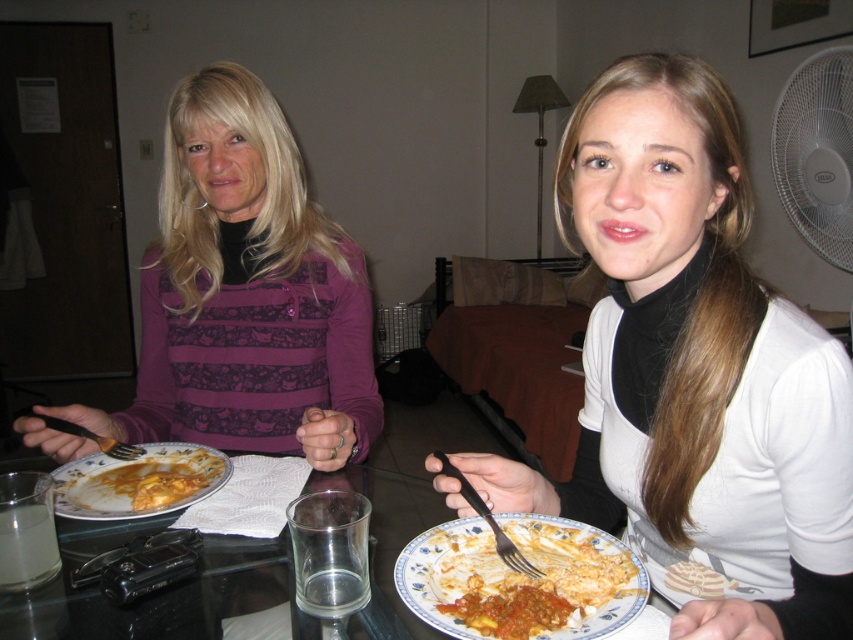
Question: Does purple lace sweater at upper left have a smaller size compared to glassy plastic table at center?

Choices:
 (A) no
 (B) yes

Answer: (A)

Question: Does glassy plastic table at center appear over white plastic fan at upper right?

Choices:
 (A) no
 (B) yes

Answer: (A)

Question: Does white matte shirt at center have a greater width compared to black plastic fork at lower center?

Choices:
 (A) no
 (B) yes

Answer: (B)

Question: Estimate the real-world distances between objects in this image. Which object is farther from the black plastic fork at left?

Choices:
 (A) porcelain floral plate at lower center
 (B) tomato sauce pasta at lower center
 (C) purple lace sweater at upper left
 (D) white plastic fan at upper right

Answer: (D)

Question: Estimate the real-world distances between objects in this image. Which object is farther from the purple lace sweater at upper left?

Choices:
 (A) porcelain floral plate at lower center
 (B) black plastic fork at left
 (C) white matte shirt at center
 (D) black plastic fork at lower center

Answer: (D)

Question: Which of the following is the farthest from the observer?

Choices:
 (A) (171, 452)
 (B) (796, 220)

Answer: (B)